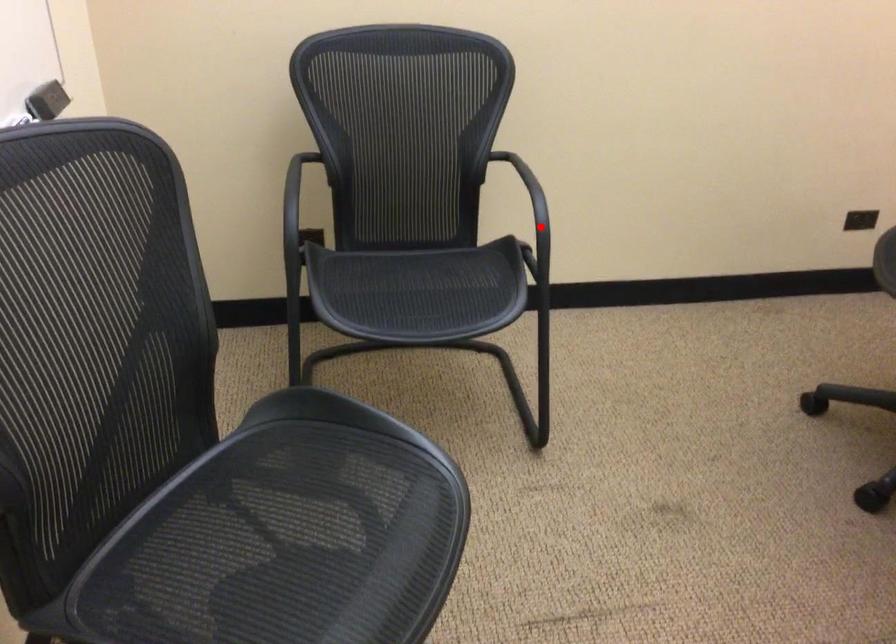
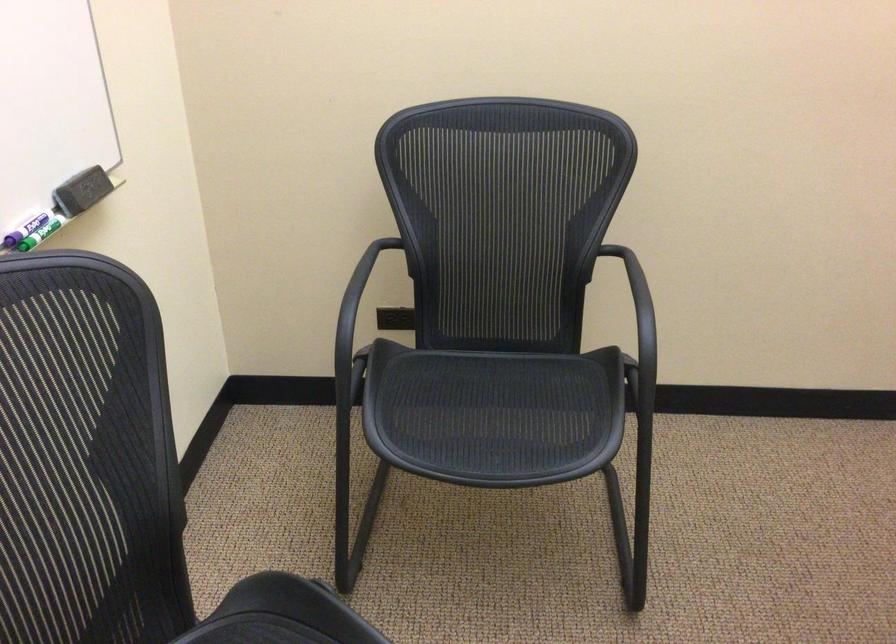
Question: I am providing you with two images of the same scene from different viewpoints. A red point is marked on the first image. At the location where the point appears in image 1, is it still visible in image 2?

Choices:
 (A) Yes
 (B) No

Answer: (A)